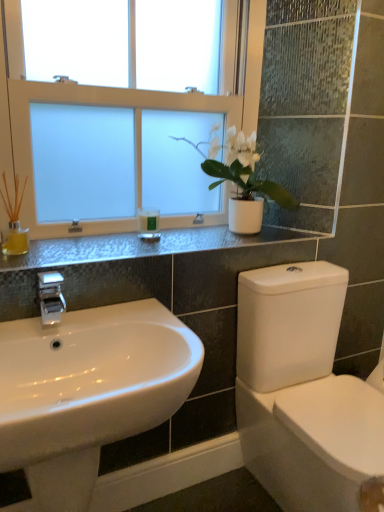
You are a GUI agent. You are given a task and a screenshot of the screen. Output one action in this format:
    pyautogui.click(x=<x>, y=<y>)
    Task: Click on the blank area to the left of green matte candle at center
    
    Given the screenshot: What is the action you would take?
    [106, 241]